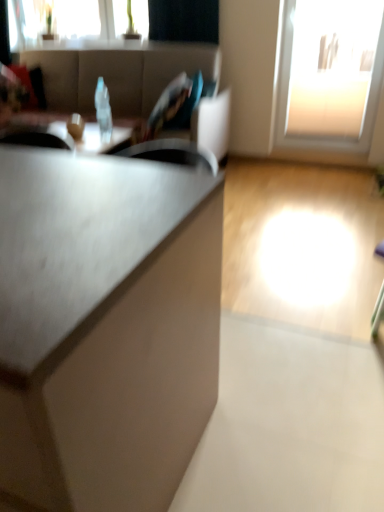
Question: Does matte white bowl at center appear on the right side of matte black table at center?

Choices:
 (A) yes
 (B) no

Answer: (A)

Question: Does matte white bowl at center have a smaller size compared to matte black table at center?

Choices:
 (A) yes
 (B) no

Answer: (A)

Question: Is matte white bowl at center shorter than matte black table at center?

Choices:
 (A) no
 (B) yes

Answer: (B)

Question: Is matte white bowl at center located outside matte black table at center?

Choices:
 (A) yes
 (B) no

Answer: (A)

Question: Is matte black table at center surrounded by matte white bowl at center?

Choices:
 (A) no
 (B) yes

Answer: (A)

Question: Considering the relative positions of matte white bowl at center and matte black table at center in the image provided, is matte white bowl at center to the left of matte black table at center from the viewer's perspective?

Choices:
 (A) yes
 (B) no

Answer: (B)

Question: Does matte gray cabinet at center have a larger size compared to transparent glass door at upper right, the 1th window positioned from the bottom?

Choices:
 (A) no
 (B) yes

Answer: (B)

Question: Is matte gray cabinet at center wider than transparent glass door at upper right, the 1th window positioned from the bottom?

Choices:
 (A) yes
 (B) no

Answer: (A)

Question: Is matte gray cabinet at center positioned behind transparent glass door at upper right, the 1th window positioned from the bottom?

Choices:
 (A) yes
 (B) no

Answer: (B)

Question: Does matte gray cabinet at center have a smaller size compared to transparent glass door at upper right, the 1th window positioned from the bottom?

Choices:
 (A) no
 (B) yes

Answer: (A)

Question: Is matte gray cabinet at center next to transparent glass door at upper right, which is the 2th window from left to right, and touching it?

Choices:
 (A) yes
 (B) no

Answer: (B)

Question: Does matte gray cabinet at center have a greater height compared to transparent glass door at upper right, acting as the 1th window starting from the right?

Choices:
 (A) no
 (B) yes

Answer: (A)

Question: Considering the relative positions of transparent glass window at upper left, the 2th window positioned from the bottom, and transparent glass door at upper right, which is the 2th window from left to right, in the image provided, is transparent glass window at upper left, the 2th window positioned from the bottom, to the right of transparent glass door at upper right, which is the 2th window from left to right, from the viewer's perspective?

Choices:
 (A) yes
 (B) no

Answer: (B)